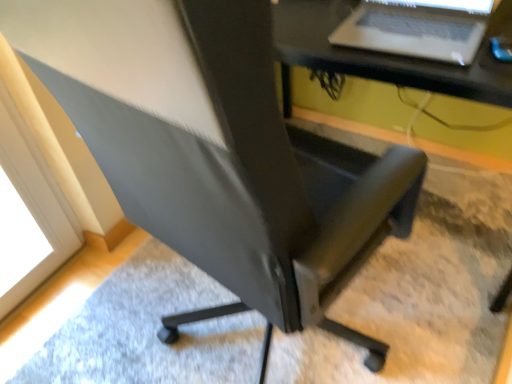
Question: From the image's perspective, does silver metallic laptop at upper right appear higher than black plastic computer desk at center?

Choices:
 (A) no
 (B) yes

Answer: (B)

Question: Does silver metallic laptop at upper right have a greater width compared to black plastic computer desk at center?

Choices:
 (A) yes
 (B) no

Answer: (B)

Question: Would you consider silver metallic laptop at upper right to be distant from black plastic computer desk at center?

Choices:
 (A) yes
 (B) no

Answer: (B)

Question: Is silver metallic laptop at upper right facing away from black plastic computer desk at center?

Choices:
 (A) no
 (B) yes

Answer: (A)

Question: Considering the relative positions of silver metallic laptop at upper right and black plastic computer desk at center in the image provided, is silver metallic laptop at upper right to the left of black plastic computer desk at center from the viewer's perspective?

Choices:
 (A) no
 (B) yes

Answer: (B)

Question: Considering the relative positions of silver metallic laptop at upper right and black plastic computer desk at center in the image provided, is silver metallic laptop at upper right to the right of black plastic computer desk at center from the viewer's perspective?

Choices:
 (A) no
 (B) yes

Answer: (A)

Question: Is black plastic computer desk at center taller than silver metallic laptop at upper right?

Choices:
 (A) yes
 (B) no

Answer: (A)

Question: Is black plastic computer desk at center thinner than silver metallic laptop at upper right?

Choices:
 (A) no
 (B) yes

Answer: (A)

Question: Does black plastic computer desk at center appear on the right side of silver metallic laptop at upper right?

Choices:
 (A) yes
 (B) no

Answer: (A)

Question: Can we say black plastic computer desk at center lies outside silver metallic laptop at upper right?

Choices:
 (A) yes
 (B) no

Answer: (A)

Question: From a real-world perspective, is black plastic computer desk at center positioned over silver metallic laptop at upper right based on gravity?

Choices:
 (A) yes
 (B) no

Answer: (B)

Question: From a real-world perspective, is black plastic computer desk at center positioned under silver metallic laptop at upper right based on gravity?

Choices:
 (A) no
 (B) yes

Answer: (B)

Question: From the image's perspective, is black plastic computer desk at center above or below silver metallic laptop at upper right?

Choices:
 (A) below
 (B) above

Answer: (A)